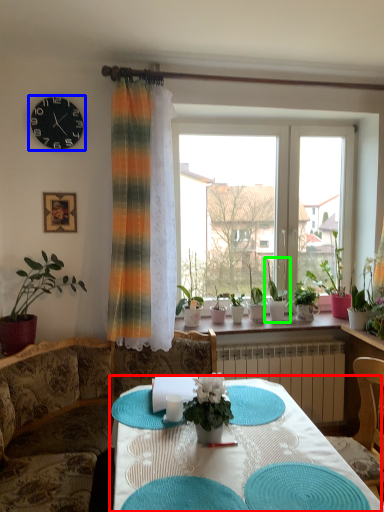
Question: Which is farther away from table (highlighted by a red box)? clock (highlighted by a blue box) or houseplant (highlighted by a green box)?

Choices:
 (A) clock
 (B) houseplant

Answer: (A)